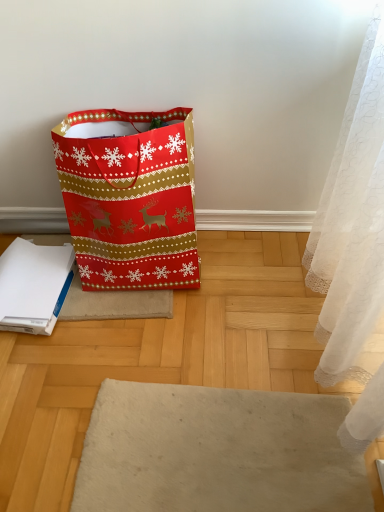
Where is `free point above white paper notebook at lower left (from a real-world perspective)`? The image size is (384, 512). free point above white paper notebook at lower left (from a real-world perspective) is located at coordinates (34, 279).